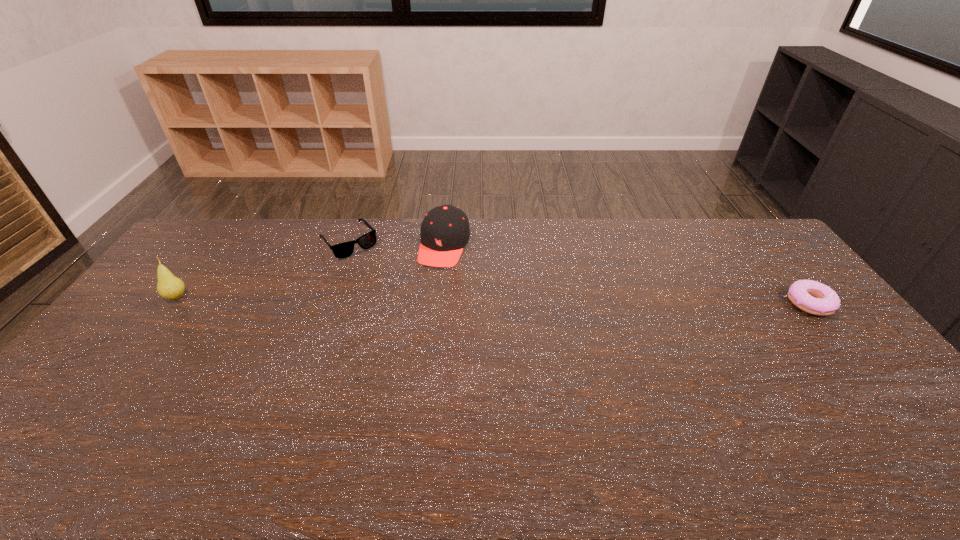
Locate an element on the screen. vacant region between the doughnut and the leftmost object is located at coordinates (493, 300).

Locate an element on the screen. The image size is (960, 540). free spot between the doughnut and the sunglasses is located at coordinates (579, 272).

At what (x,y) coordinates should I click in order to perform the action: click on free space between the rightmost object and the third object from right to left. Please return your answer as a coordinate pair (x, y). This screenshot has height=540, width=960. Looking at the image, I should click on pyautogui.click(x=579, y=272).

The image size is (960, 540). I want to click on vacant space that's between the rightmost object and the sunglasses, so click(x=579, y=272).

Identify the location of empty space between the cap and the rightmost object. The width and height of the screenshot is (960, 540). (627, 274).

Identify the location of object that is the closest to the third tallest object. The image size is (960, 540). 445,231.

Point out which object is positioned as the second nearest to the second object from right to left. Please provide its 2D coordinates. Your answer should be formatted as a tuple, i.e. [(x, y)], where the tuple contains the x and y coordinates of a point satisfying the conditions above.

[(169, 287)]

This screenshot has height=540, width=960. In order to click on free point that satisfies the following two spatial constraints: 1. on the front side of the shortest object; 2. on the right side of the second tallest object in this screenshot , I will do `click(439, 303)`.

At what (x,y) coordinates should I click in order to perform the action: click on vacant space that satisfies the following two spatial constraints: 1. on the front side of the sunglasses; 2. on the left side of the cap. Please return your answer as a coordinate pair (x, y). Looking at the image, I should click on (347, 246).

Where is `free spot that satisfies the following two spatial constraints: 1. on the front side of the sunglasses; 2. on the right side of the second object from right to left`? This screenshot has width=960, height=540. free spot that satisfies the following two spatial constraints: 1. on the front side of the sunglasses; 2. on the right side of the second object from right to left is located at coordinates coord(347,246).